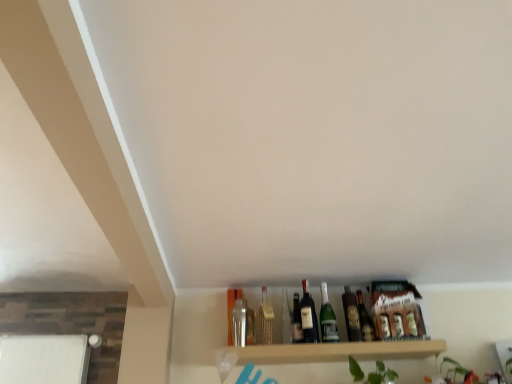
Question: Can you confirm if matte glass beer bottle at center, which is counted as the 2th beer bottle, starting from the left, is wider than matte glass bottle at center, the 3th bottle when ordered from right to left?

Choices:
 (A) yes
 (B) no

Answer: (A)

Question: Does matte glass beer bottle at center, which appears as the first beer bottle when viewed from the right, have a lesser width compared to matte glass bottle at center, which ranks as the second bottle in left-to-right order?

Choices:
 (A) yes
 (B) no

Answer: (B)

Question: Can you confirm if matte glass beer bottle at center, which appears as the first beer bottle when viewed from the right, is smaller than matte glass bottle at center, the 3th bottle when ordered from right to left?

Choices:
 (A) yes
 (B) no

Answer: (B)

Question: Is matte glass beer bottle at center, which appears as the first beer bottle when viewed from the right, behind matte glass bottle at center, the 3th bottle when ordered from right to left?

Choices:
 (A) yes
 (B) no

Answer: (B)

Question: From a real-world perspective, is matte glass beer bottle at center, which is counted as the 2th beer bottle, starting from the left, below matte glass bottle at center, which ranks as the second bottle in left-to-right order?

Choices:
 (A) no
 (B) yes

Answer: (A)

Question: Considering the positions of shiny dark glass bottle at center, which is counted as the first bottle, starting from the right, and metallic silver bottle at center, which appears as the fourth bottle when viewed from the right, in the image, is shiny dark glass bottle at center, which is counted as the first bottle, starting from the right, taller or shorter than metallic silver bottle at center, which appears as the fourth bottle when viewed from the right,?

Choices:
 (A) short
 (B) tall

Answer: (A)

Question: From a real-world perspective, is shiny dark glass bottle at center, the 4th bottle positioned from the left, above or below metallic silver bottle at center, arranged as the 1th bottle when viewed from the left?

Choices:
 (A) above
 (B) below

Answer: (B)

Question: Considering the relative positions of shiny dark glass bottle at center, which is counted as the first bottle, starting from the right, and metallic silver bottle at center, arranged as the 1th bottle when viewed from the left, in the image provided, is shiny dark glass bottle at center, which is counted as the first bottle, starting from the right, to the left or to the right of metallic silver bottle at center, arranged as the 1th bottle when viewed from the left,?

Choices:
 (A) right
 (B) left

Answer: (A)

Question: From the image's perspective, is shiny dark glass bottle at center, the 4th bottle positioned from the left, positioned above or below metallic silver bottle at center, arranged as the 1th bottle when viewed from the left?

Choices:
 (A) below
 (B) above

Answer: (A)

Question: In terms of width, does green glass bottle at center, the third bottle when ordered from left to right, look wider or thinner when compared to matte glass beer bottle at center, which appears as the first beer bottle when viewed from the right?

Choices:
 (A) thin
 (B) wide

Answer: (A)

Question: Based on their sizes in the image, would you say green glass bottle at center, which ranks as the second bottle in right-to-left order, is bigger or smaller than matte glass beer bottle at center, which appears as the first beer bottle when viewed from the right?

Choices:
 (A) big
 (B) small

Answer: (A)

Question: In terms of height, does green glass bottle at center, which ranks as the second bottle in right-to-left order, look taller or shorter compared to matte glass beer bottle at center, which is counted as the 2th beer bottle, starting from the left?

Choices:
 (A) short
 (B) tall

Answer: (B)

Question: Do you think green glass bottle at center, which ranks as the second bottle in right-to-left order, is within matte glass beer bottle at center, which appears as the first beer bottle when viewed from the right, or outside of it?

Choices:
 (A) outside
 (B) inside

Answer: (A)

Question: From the image's perspective, is shiny dark glass bottle at center, the 4th bottle positioned from the left, located above or below matte glass beer bottle at center, placed as the 2th beer bottle when sorted from right to left?

Choices:
 (A) below
 (B) above

Answer: (A)

Question: From their relative heights in the image, would you say shiny dark glass bottle at center, the 4th bottle positioned from the left, is taller or shorter than matte glass beer bottle at center, acting as the first beer bottle starting from the left?

Choices:
 (A) short
 (B) tall

Answer: (A)